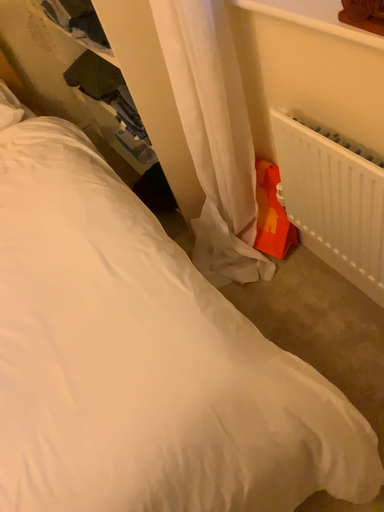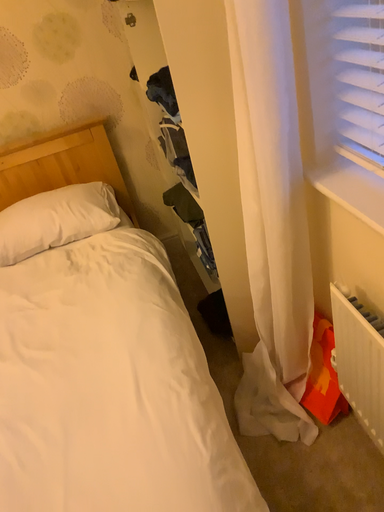
Question: How did the camera likely rotate when shooting the video?

Choices:
 (A) rotated right
 (B) rotated left

Answer: (B)